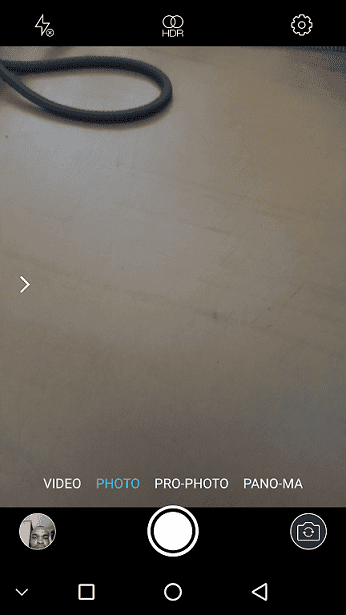
At what (x,y) coordinates should I click in order to perform the action: click on gallery. Please return your answer as a coordinate pair (x, y). The width and height of the screenshot is (346, 615). Looking at the image, I should click on (38, 536).